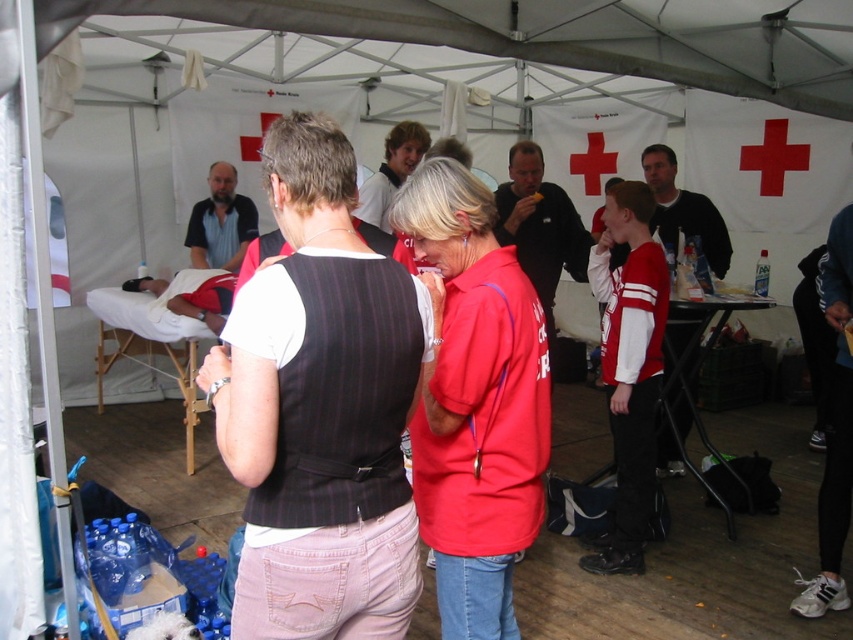
What are the coordinates of `dark brown hair at center` in the screenshot? It's located at (219, 221).

Which of these two, dark brown hair at center or smooth white shirt at center, stands shorter?

With less height is smooth white shirt at center.

The image size is (853, 640). Find the location of `dark brown hair at center`. dark brown hair at center is located at coordinates (219, 221).

Is black pinstripe vest at center bigger than matte black shirt at center?

No, black pinstripe vest at center is not bigger than matte black shirt at center.

The height and width of the screenshot is (640, 853). Describe the element at coordinates (320, 408) in the screenshot. I see `black pinstripe vest at center` at that location.

Identify the location of black pinstripe vest at center. This screenshot has width=853, height=640. (320, 408).

Is point (463, 584) closer to camera compared to point (718, 214)?

Yes, point (463, 584) is in front of point (718, 214).

Is matte red polo shirt at center positioned before dark gray sweater at center?

That is True.

Between point (422, 413) and point (651, 177), which one is positioned in front?

Positioned in front is point (422, 413).

At what (x,y) coordinates should I click in order to perform the action: click on matte red polo shirt at center. Please return your answer as a coordinate pair (x, y). Looking at the image, I should click on (476, 403).